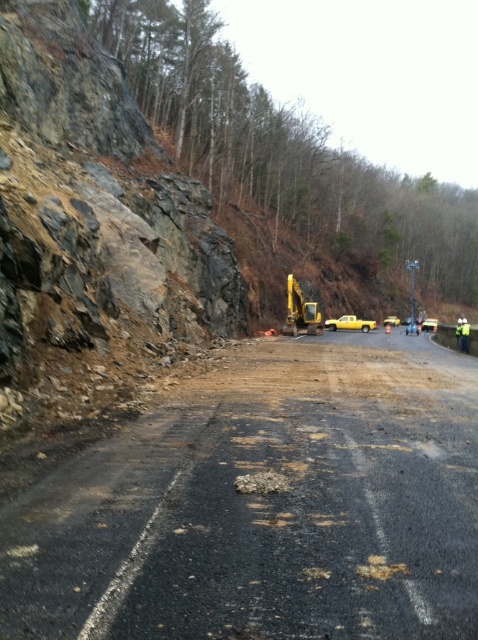
You are a surveyor standing at the point marked by the coordinates point (265,506). Based on the scene, what is the primary surface material beneath your feet?

The point (265,506) marks asphalt road at center, so the primary surface material beneath your feet is asphalt.

In the scene shown: You are a delivery driver who needs to transport a tall cargo container that is 3 meters in height. You arrive at the road construction site and see the asphalt road at center and the yellow rubber excavator at center. Can you safely pass through the area with your cargo container?

The asphalt road at center is not as tall as yellow rubber excavator at center, which means the height restriction is determined by the excavator. Since the cargo container is 3 meters tall and the excavator is taller than the road, you may not be able to pass safely unless the excavator is moved or there is enough clearance under it. Check the actual height clearance under the excavator before proceeding.